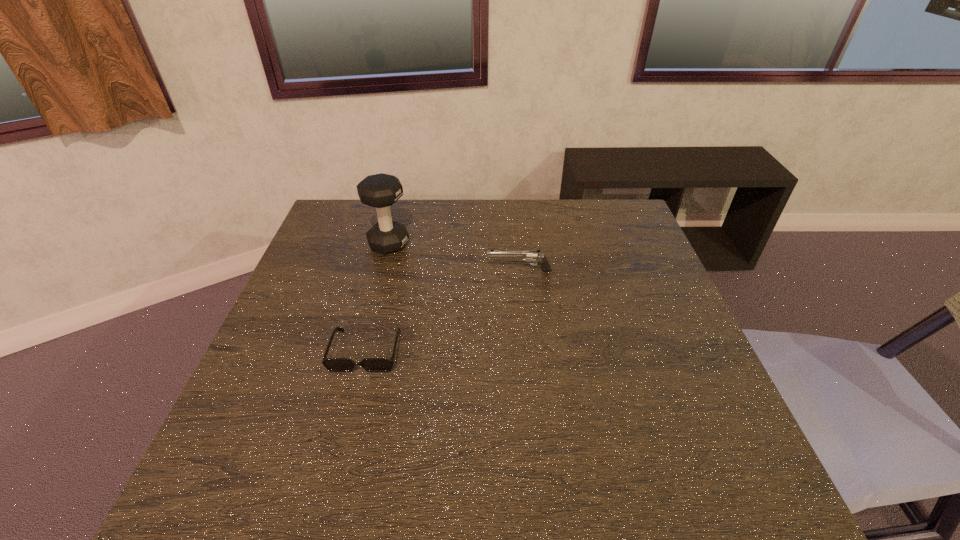
You are a GUI agent. You are given a task and a screenshot of the screen. Output one action in this format:
    pyautogui.click(x=<x>, y=<y>)
    Task: Click on the free area in between the sunglasses and the second shortest object
    
    Given the screenshot: What is the action you would take?
    click(x=443, y=311)

You are a GUI agent. You are given a task and a screenshot of the screen. Output one action in this format:
    pyautogui.click(x=<x>, y=<y>)
    Task: Click on the vacant point located between the pistol and the shortest object
    The width and height of the screenshot is (960, 540).
    Given the screenshot: What is the action you would take?
    pyautogui.click(x=443, y=311)

You are a GUI agent. You are given a task and a screenshot of the screen. Output one action in this format:
    pyautogui.click(x=<x>, y=<y>)
    Task: Click on the vacant region between the rightmost object and the tallest object
    The image size is (960, 540).
    Given the screenshot: What is the action you would take?
    pyautogui.click(x=454, y=258)

Where is `empty space between the tallest object and the shortest object`? empty space between the tallest object and the shortest object is located at coordinates (377, 297).

Find the location of `free point between the second tallest object and the sunglasses`. free point between the second tallest object and the sunglasses is located at coordinates (443, 311).

Identify the location of vacant space that is in between the sunglasses and the pistol. (443, 311).

At what (x,y) coordinates should I click in order to perform the action: click on vacant area that lies between the sunglasses and the tallest object. Please return your answer as a coordinate pair (x, y). Looking at the image, I should click on (377, 297).

Identify the location of free spot between the sunglasses and the tallest object. Image resolution: width=960 pixels, height=540 pixels. (377, 297).

Find the location of a particular element. Image resolution: width=960 pixels, height=540 pixels. free space between the tallest object and the second nearest object is located at coordinates (454, 258).

Where is `object that ranks as the closest to the pistol`? This screenshot has height=540, width=960. object that ranks as the closest to the pistol is located at coordinates (381, 190).